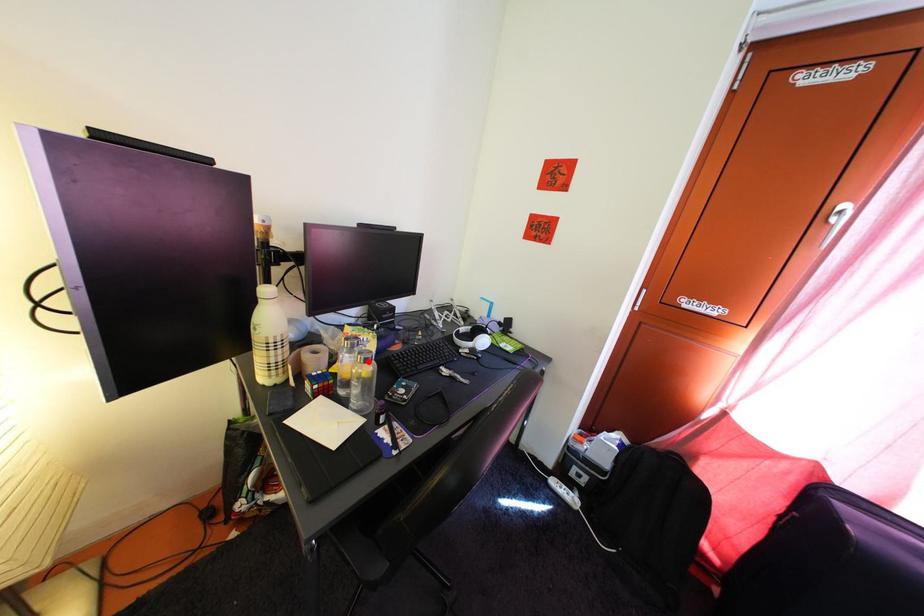
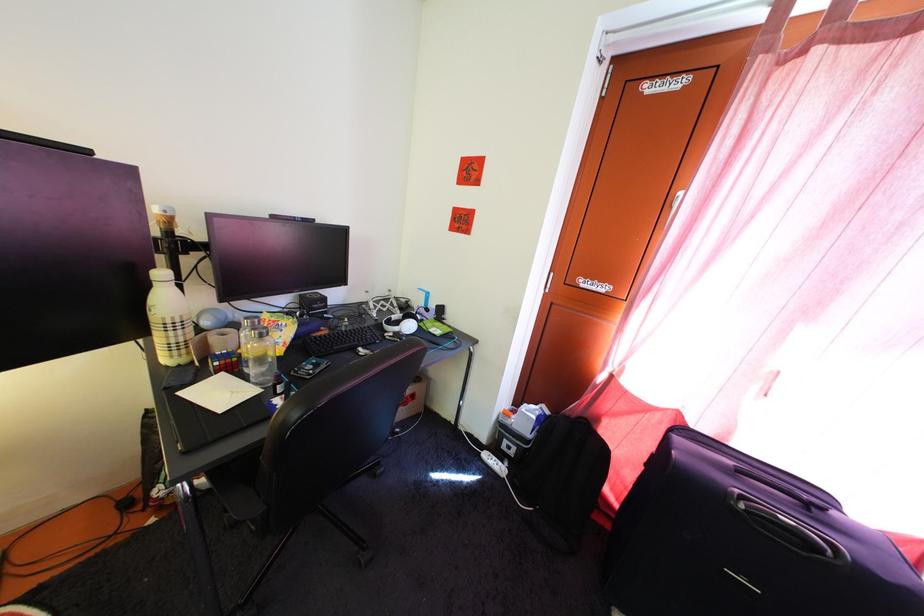
The point at the highlighted location is marked in the first image. Where is the corresponding point in the second image?

(262, 338)